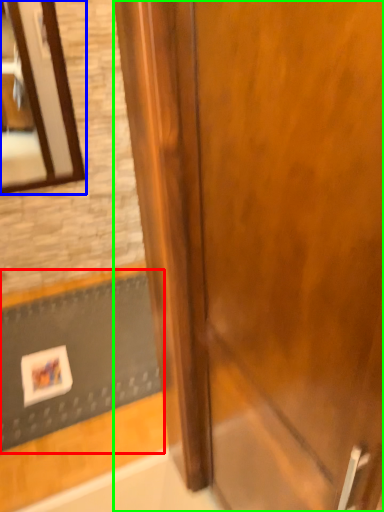
Question: Based on their relative distances, which object is farther from doormat (highlighted by a red box)? Choose from mirror (highlighted by a blue box) and door (highlighted by a green box).

Choices:
 (A) mirror
 (B) door

Answer: (B)